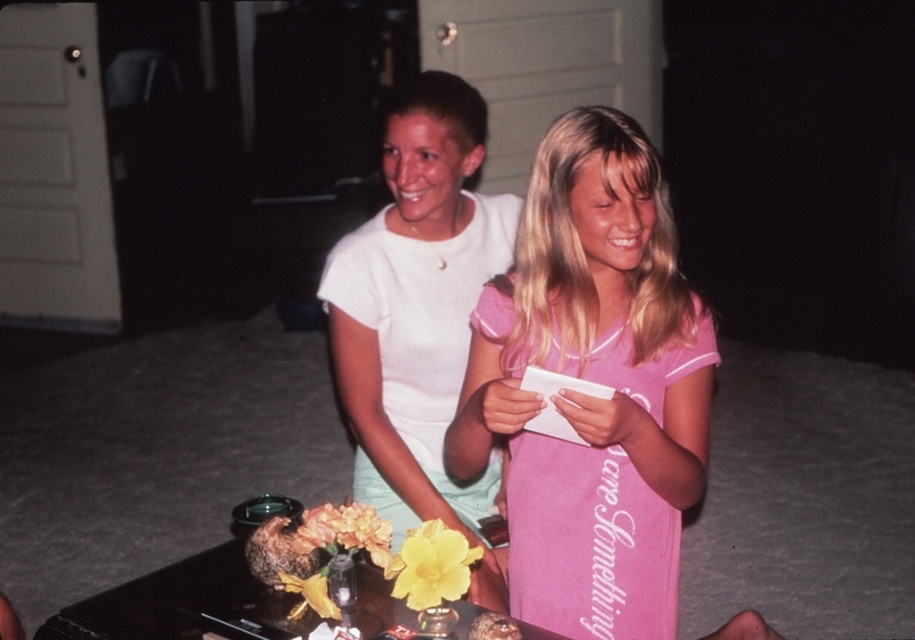
Does pink cotton dress at center have a greater width compared to smooth brown bread at lower center?

Indeed, pink cotton dress at center has a greater width compared to smooth brown bread at lower center.

Which is in front, point (657, 358) or point (507, 625)?

Positioned in front is point (507, 625).

This screenshot has height=640, width=915. I want to click on pink cotton dress at center, so click(x=595, y=381).

Can you confirm if white matte shirt at center is taller than smooth brown bread at lower center?

Yes.

Is white matte shirt at center to the right of smooth brown bread at lower center from the viewer's perspective?

Incorrect, white matte shirt at center is not on the right side of smooth brown bread at lower center.

The width and height of the screenshot is (915, 640). I want to click on white matte shirt at center, so click(x=417, y=305).

Who is shorter, white matte shirt at center or black glossy table at lower center?

With less height is black glossy table at lower center.

Between white matte shirt at center and black glossy table at lower center, which one has more height?

white matte shirt at center is taller.

Is point (404, 385) more distant than point (170, 628)?

Yes, point (404, 385) is farther from viewer.

Image resolution: width=915 pixels, height=640 pixels. I want to click on white matte shirt at center, so click(x=417, y=305).